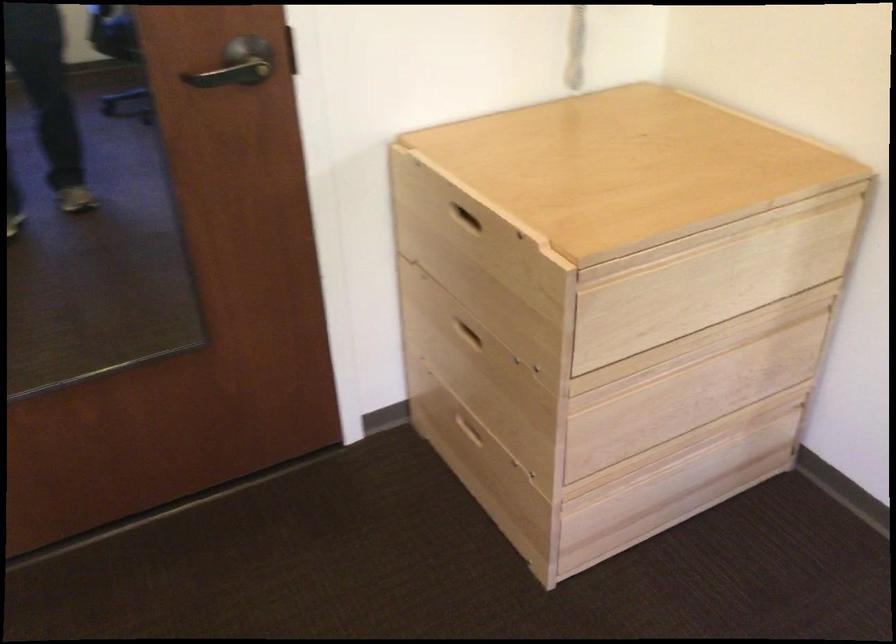
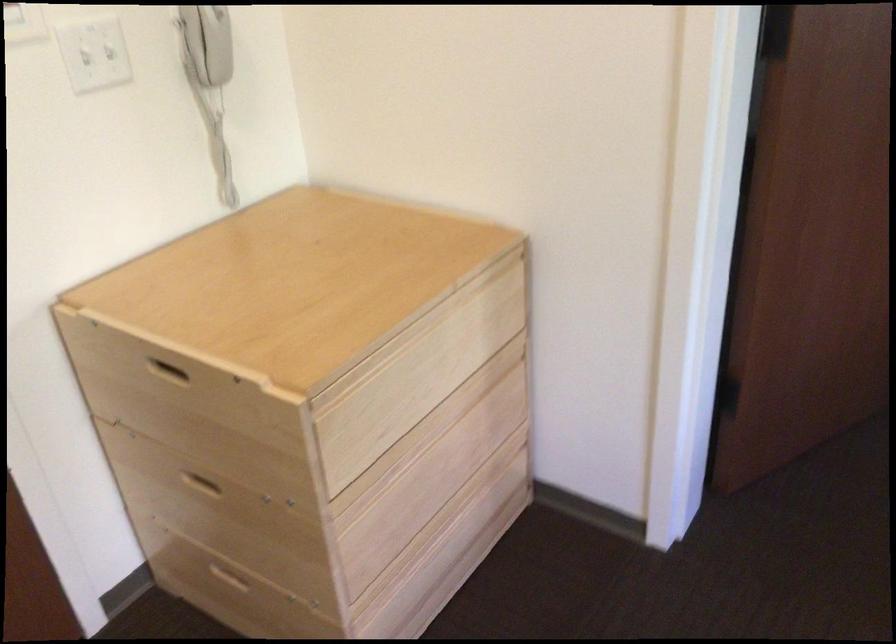
Where in the second image is the point corresponding to (464,330) from the first image?

(201, 483)